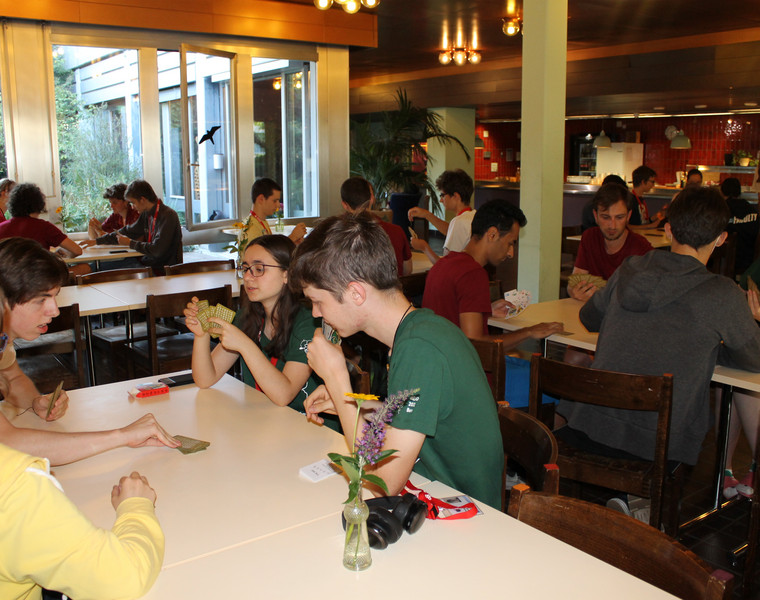
I want to click on inside a restaurant, so click(x=546, y=377).